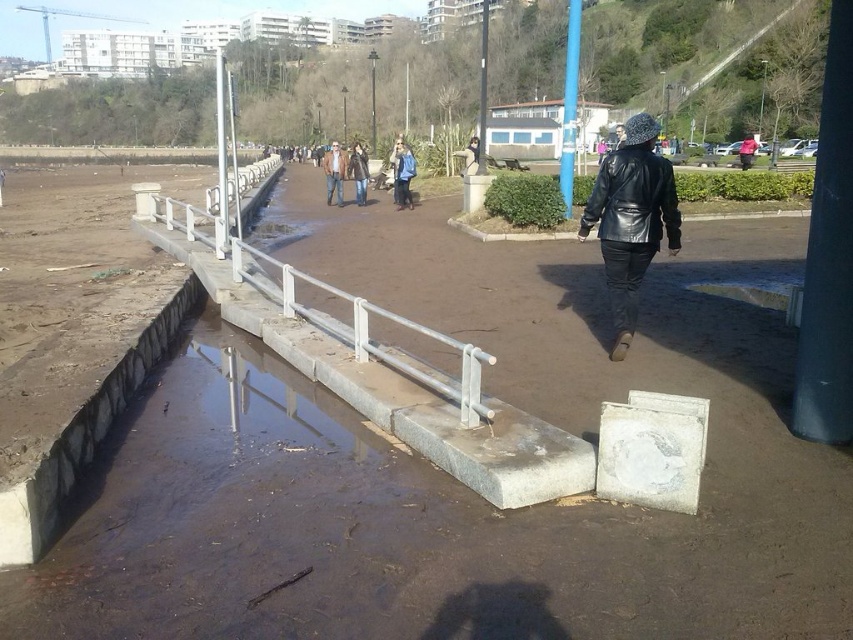
You are standing at point (x=473, y=166) and want to walk to point (x=396, y=177). Which direction should you move relative to your current position?

You should move forward because point (x=396, y=177) is behind point (x=473, y=166), meaning it is in the direction you are facing as you walk away from your current position.

You are a photographer trying to capture both the blue denim jacket at center and the matte black jacket at center in a single frame. Given their sizes, which jacket will appear smaller in the photo?

The blue denim jacket at center will appear smaller in the photo because it occupies less space than the matte black jacket at center.

You are a photographer trying to capture both the denim jacket at center and the matte black jacket at center in a single frame. Given their sizes, which jacket will appear smaller in the photo?

The denim jacket at center will appear smaller in the photo because it occupies less space than the matte black jacket at center.